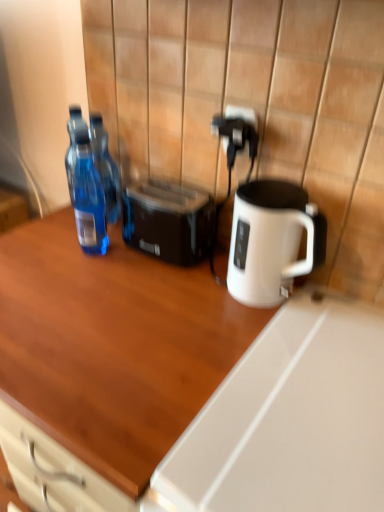
Question: Is point (96, 141) positioned closer to the camera than point (213, 437)?

Choices:
 (A) closer
 (B) farther

Answer: (B)

Question: From a real-world perspective, relative to wooden desk at center, is transparent plastic bottle at left, which ranks as the first bottle in back-to-front order, vertically above or below?

Choices:
 (A) above
 (B) below

Answer: (A)

Question: Which object is positioned farthest from the wooden desk at center?

Choices:
 (A) transparent plastic bottle at left, the second bottle in the front-to-back sequence
 (B) black plastic toaster at center
 (C) black plastic electric outlet at upper right
 (D) transparent plastic bottle at left, the second bottle positioned from the back

Answer: (C)

Question: Estimate the real-world distances between objects in this image. Which object is farther from the transparent plastic bottle at left, the second bottle in the front-to-back sequence?

Choices:
 (A) transparent plastic bottle at left, the 1th bottle positioned from the front
 (B) black plastic electric outlet at upper right
 (C) black plastic toaster at center
 (D) wooden desk at center

Answer: (D)